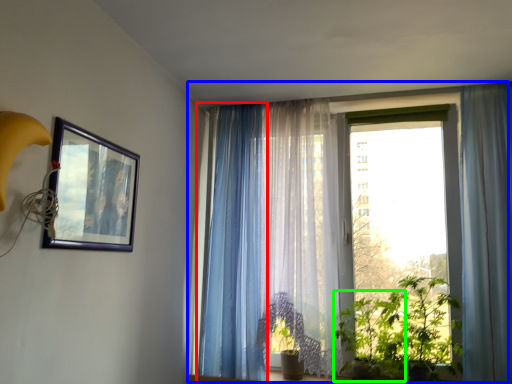
Question: Which is nearer to the curtain (highlighted by a red box)? window (highlighted by a blue box) or plant (highlighted by a green box).

Choices:
 (A) window
 (B) plant

Answer: (B)